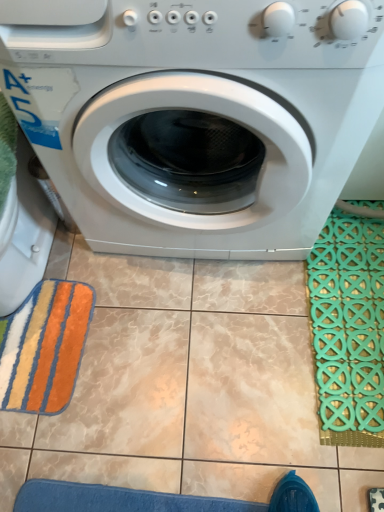
Where is `vacant space situated above green rubber bath mat at right (from a real-world perspective)`? The width and height of the screenshot is (384, 512). vacant space situated above green rubber bath mat at right (from a real-world perspective) is located at coordinates (353, 311).